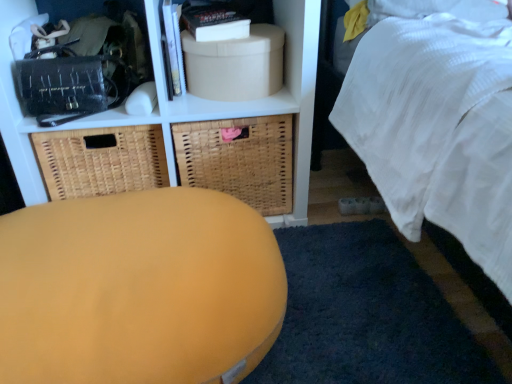
Question: Does matte white shelf at upper center appear on the left side of woven brown basket at left, the first basket in the left-to-right sequence?

Choices:
 (A) no
 (B) yes

Answer: (A)

Question: Is matte white shelf at upper center wider than woven brown basket at left, the first basket in the left-to-right sequence?

Choices:
 (A) no
 (B) yes

Answer: (B)

Question: Would you say woven brown basket at left, the 2th basket positioned from the right, is part of matte white shelf at upper center's contents?

Choices:
 (A) yes
 (B) no

Answer: (A)

Question: From a real-world perspective, does matte white shelf at upper center sit lower than woven brown basket at left, the 2th basket positioned from the right?

Choices:
 (A) yes
 (B) no

Answer: (B)

Question: Is the position of matte white shelf at upper center less distant than that of woven brown basket at left, the first basket in the left-to-right sequence?

Choices:
 (A) no
 (B) yes

Answer: (B)

Question: Is matte white shelf at upper center in contact with woven brown basket at left, the 2th basket positioned from the right?

Choices:
 (A) yes
 (B) no

Answer: (B)

Question: Is woven brown basket at center, the first basket viewed from the right, positioned beyond the bounds of beige cardboard box at upper center?

Choices:
 (A) yes
 (B) no

Answer: (A)

Question: Is woven brown basket at center, which appears as the second basket when viewed from the left, aimed at beige cardboard box at upper center?

Choices:
 (A) no
 (B) yes

Answer: (A)

Question: Is woven brown basket at center, which appears as the second basket when viewed from the left, to the right of beige cardboard box at upper center from the viewer's perspective?

Choices:
 (A) no
 (B) yes

Answer: (A)

Question: From the image's perspective, is woven brown basket at center, the first basket viewed from the right, on beige cardboard box at upper center?

Choices:
 (A) yes
 (B) no

Answer: (B)

Question: Can you confirm if woven brown basket at center, the first basket viewed from the right, is smaller than beige cardboard box at upper center?

Choices:
 (A) no
 (B) yes

Answer: (A)

Question: Can you confirm if woven brown basket at center, the first basket viewed from the right, is bigger than beige cardboard box at upper center?

Choices:
 (A) yes
 (B) no

Answer: (A)

Question: Is woven brown basket at left, the first basket in the left-to-right sequence, closer to the viewer compared to woven brown basket at center, which appears as the second basket when viewed from the left?

Choices:
 (A) no
 (B) yes

Answer: (B)